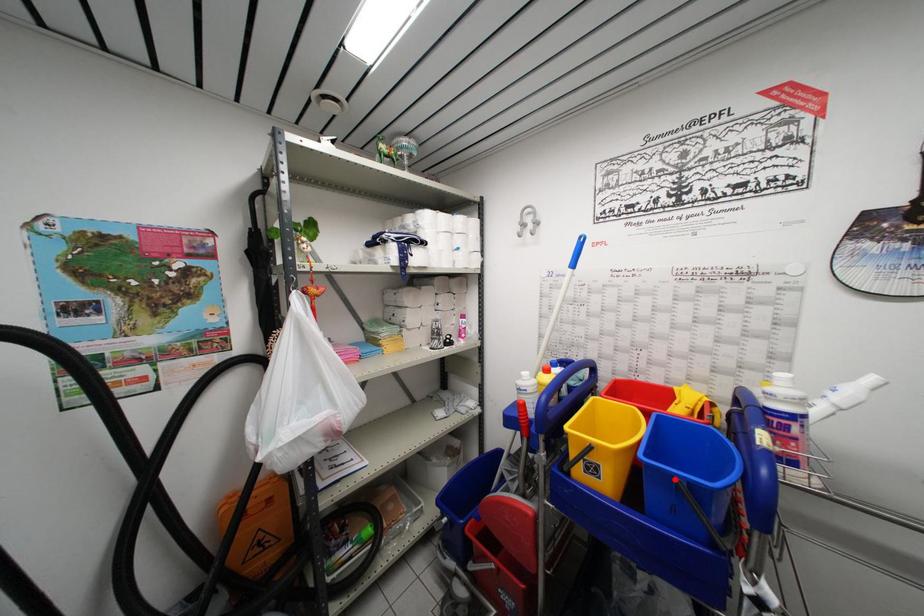
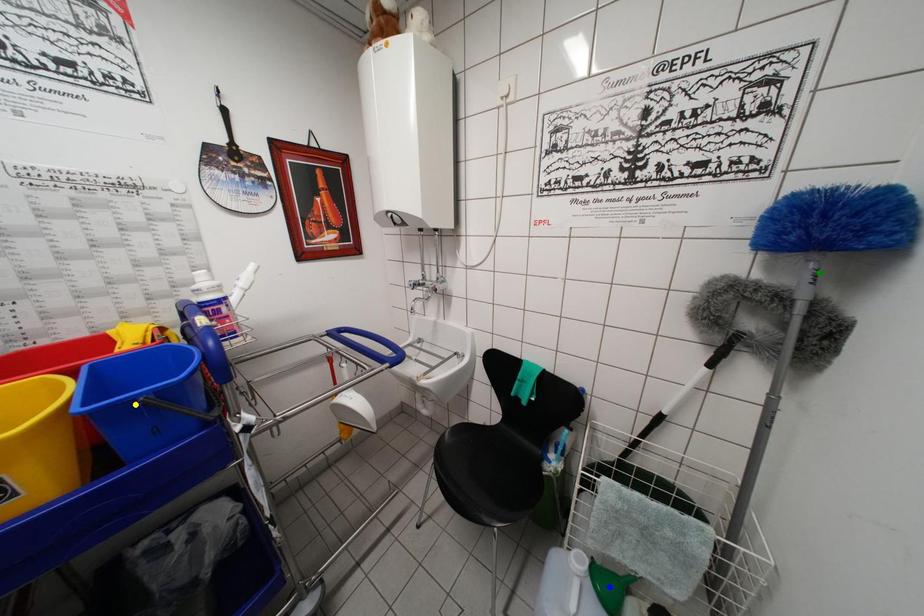
Question: I am providing you with two images of the same scene from different viewpoints. A red point is marked on the first image. You are given multiple points on the second image. Which mark in image 2 goes with the point in image 1?

Choices:
 (A) yellow point
 (B) blue point
 (C) green point

Answer: (A)